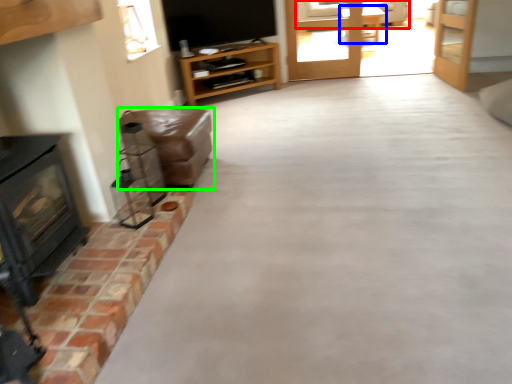
Question: Estimate the real-world distances between objects in this image. Which object is closer to couch (highlighted by a red box), table (highlighted by a blue box) or furniture (highlighted by a green box)?

Choices:
 (A) table
 (B) furniture

Answer: (A)